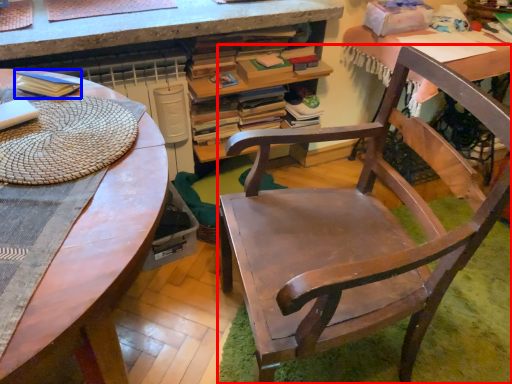
Question: Which of the following is the closest to the observer, chair (highlighted by a red box) or paperback book (highlighted by a blue box)?

Choices:
 (A) chair
 (B) paperback book

Answer: (A)